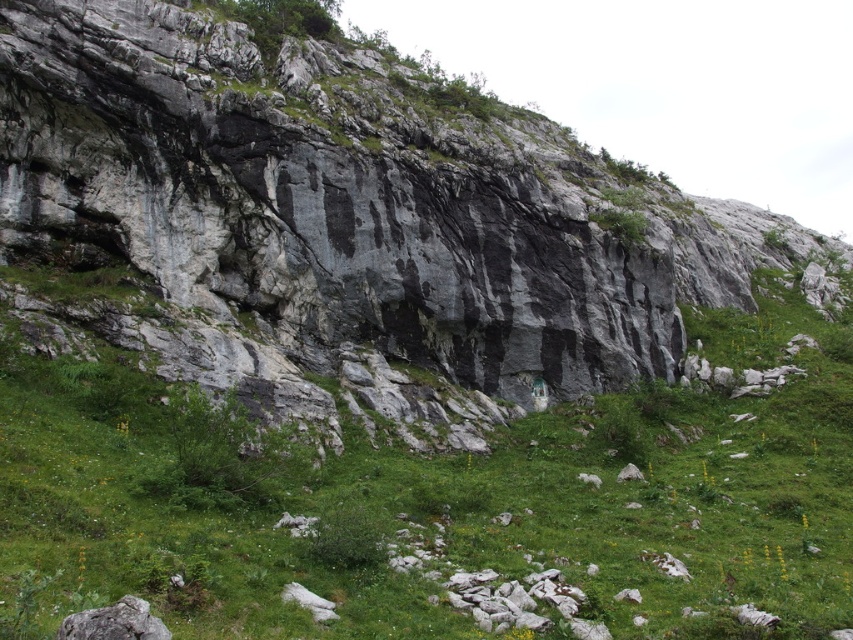
You are standing at the base of the cliff in the rugged landscape and want to take a photo of both the point at coordinates (201, 170) and the point at (831, 451). Which point should you focus on first to ensure both are in clear view?

You should focus on point (201, 170) first because it is closer to you than point (831, 451), which is further away. This ensures both points are in clear view by prioritizing the nearer object.